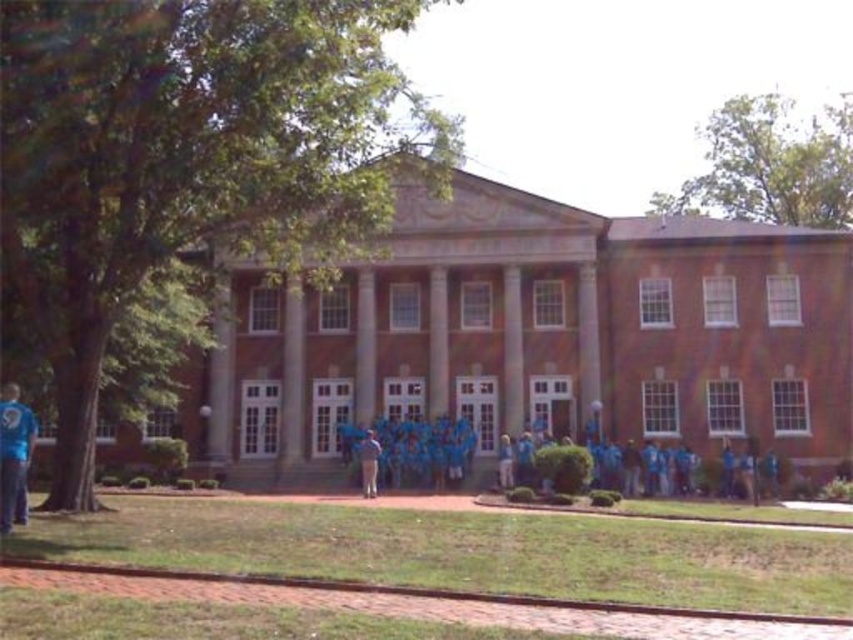
You are standing in front of a large two story brick building with a group of people in blue shirts. There is a specific point marked at coordinate (13, 456). What object is located at that coordinate?

The point at coordinate (13, 456) indicates the location of the blue fabric shirt at left.

You are a photographer taking a group photo of the blue fabric shirt at left and the blue fabric shirt at center in front of the building. Do you need to adjust their positions so that both shirts are fully visible in the photo?

The blue fabric shirt at left is positioned over the blue fabric shirt at center, so the photographer needs to adjust their positions to ensure both shirts are fully visible.